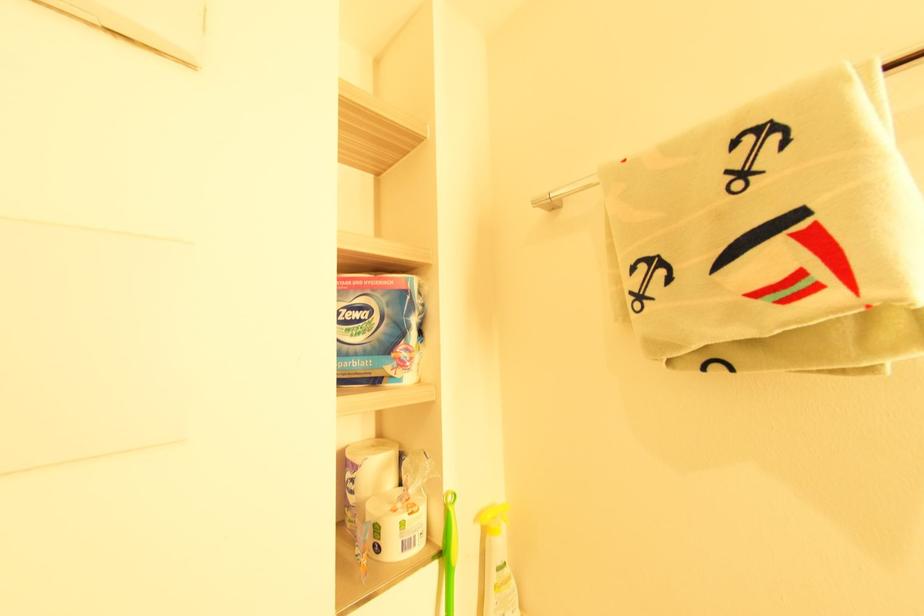
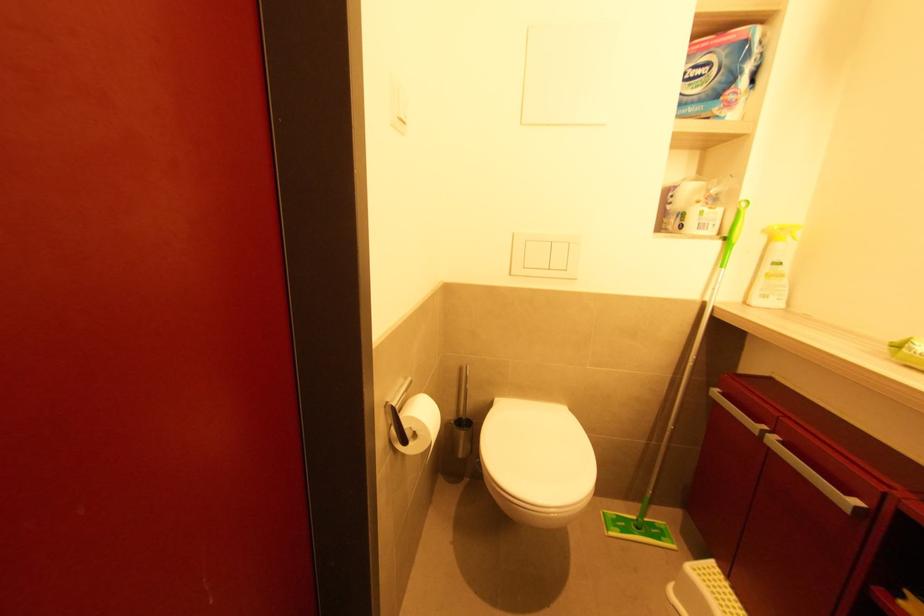
The images are taken continuously from a first-person perspective. In which direction is your viewpoint rotating?

The camera rotated toward left-down.